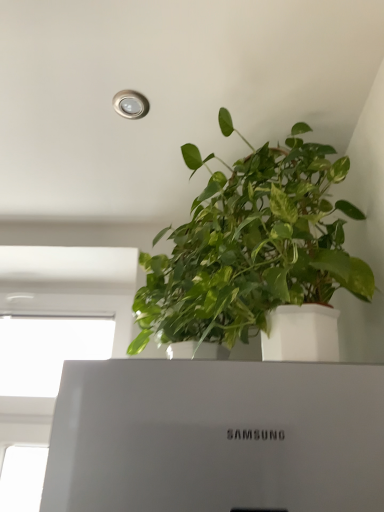
This screenshot has width=384, height=512. I want to click on free spot above green matte plant at upper center (from a real-world perspective), so click(220, 135).